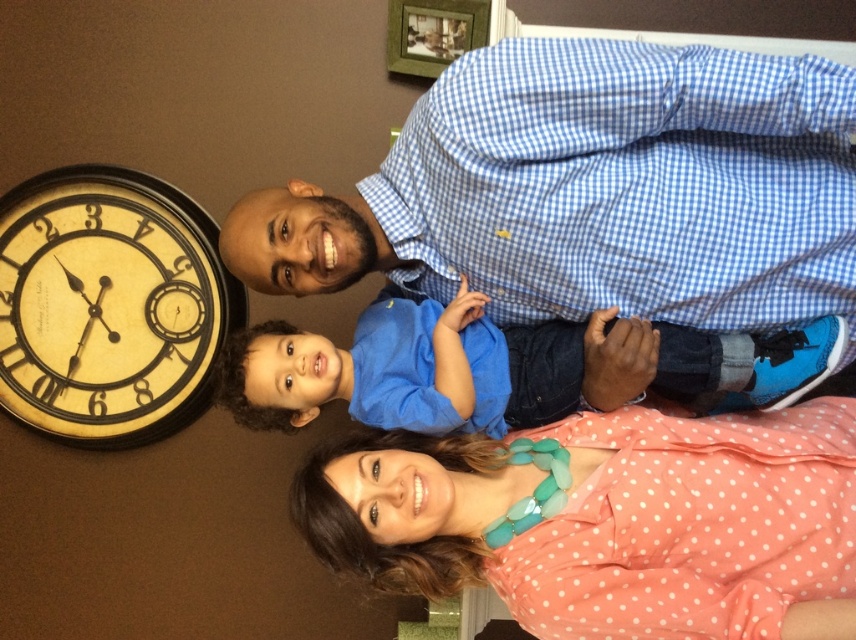
Question: Does pink polka dot blouse at lower center appear on the left side of yellow painted wood clock at left?

Choices:
 (A) yes
 (B) no

Answer: (B)

Question: Is pink polka dot blouse at lower center bigger than yellow painted wood clock at left?

Choices:
 (A) yes
 (B) no

Answer: (A)

Question: Which object appears closest to the camera in this image?

Choices:
 (A) blue cotton shirt at center
 (B) pink polka dot blouse at lower center
 (C) yellow painted wood clock at left
 (D) blue checkered shirt at upper center

Answer: (D)

Question: Among these points, which one is farthest from the camera?

Choices:
 (A) tap(242, 291)
 (B) tap(623, 339)
 (C) tap(762, 108)

Answer: (A)

Question: Which point appears farthest from the camera in this image?

Choices:
 (A) (330, 550)
 (B) (288, 186)
 (C) (171, 349)

Answer: (C)

Question: Can you confirm if pink polka dot blouse at lower center is bigger than blue cotton shirt at center?

Choices:
 (A) no
 (B) yes

Answer: (B)